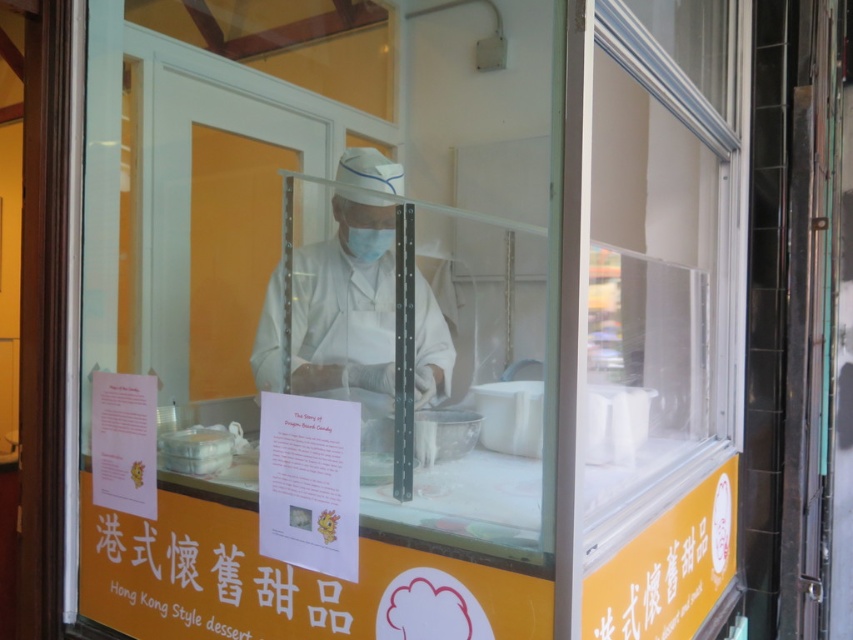
Question: Among these points, which one is nearest to the camera?

Choices:
 (A) (122, 557)
 (B) (392, 243)

Answer: (A)

Question: Is white matte uniform at center to the left of white matte mask at center from the viewer's perspective?

Choices:
 (A) yes
 (B) no

Answer: (A)

Question: Estimate the real-world distances between objects in this image. Which object is farther from the orange paper sign at lower center?

Choices:
 (A) white matte uniform at center
 (B) white matte mask at center

Answer: (B)

Question: Can you confirm if orange paper sign at lower center is positioned to the right of white matte mask at center?

Choices:
 (A) yes
 (B) no

Answer: (B)

Question: Estimate the real-world distances between objects in this image. Which object is farther from the white matte mask at center?

Choices:
 (A) white matte uniform at center
 (B) orange paper sign at lower center

Answer: (B)

Question: Can you confirm if orange paper sign at lower center is wider than white matte uniform at center?

Choices:
 (A) no
 (B) yes

Answer: (B)